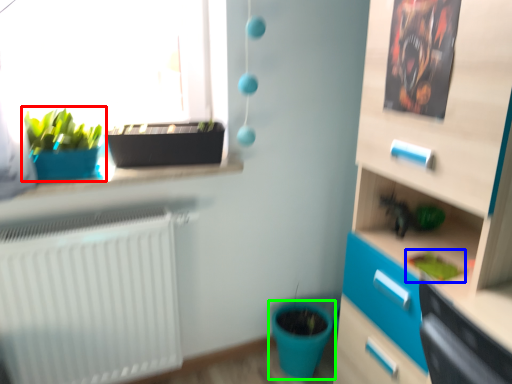
Question: Based on their relative distances, which object is nearer to houseplant (highlighted by a red box)? Choose from plant (highlighted by a blue box) and flowerpot (highlighted by a green box).

Choices:
 (A) plant
 (B) flowerpot

Answer: (A)